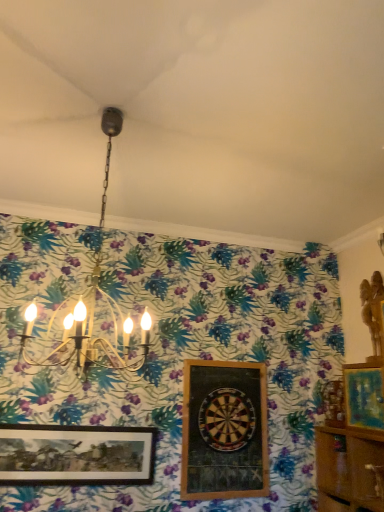
Question: Is gold metallic chandelier at upper center not close to wooden dartboard at center?

Choices:
 (A) yes
 (B) no

Answer: (B)

Question: Is gold metallic chandelier at upper center to the left of wooden dartboard at center from the viewer's perspective?

Choices:
 (A) yes
 (B) no

Answer: (A)

Question: Can you confirm if gold metallic chandelier at upper center is taller than wooden dartboard at center?

Choices:
 (A) yes
 (B) no

Answer: (A)

Question: Could wooden dartboard at center be considered to be inside gold metallic chandelier at upper center?

Choices:
 (A) yes
 (B) no

Answer: (B)

Question: From a real-world perspective, does gold metallic chandelier at upper center stand above wooden dartboard at center?

Choices:
 (A) no
 (B) yes

Answer: (B)

Question: Based on their positions, is wooden cabinet at lower right located to the left or right of teal matte painting at right, the first picture frame viewed from the right?

Choices:
 (A) left
 (B) right

Answer: (A)

Question: Is wooden cabinet at lower right in front of or behind teal matte painting at right, the 3th picture frame viewed from the left, in the image?

Choices:
 (A) front
 (B) behind

Answer: (A)

Question: In terms of width, does wooden cabinet at lower right look wider or thinner when compared to teal matte painting at right, the first picture frame viewed from the right?

Choices:
 (A) thin
 (B) wide

Answer: (B)

Question: Is wooden cabinet at lower right bigger or smaller than teal matte painting at right, the 3th picture frame viewed from the left?

Choices:
 (A) small
 (B) big

Answer: (B)

Question: Is point (354, 482) positioned closer to the camera than point (26, 356)?

Choices:
 (A) closer
 (B) farther

Answer: (A)

Question: Considering their positions, is wooden cabinet at lower right located in front of or behind gold metallic chandelier at upper center?

Choices:
 (A) front
 (B) behind

Answer: (B)

Question: Considering the positions of wooden cabinet at lower right and gold metallic chandelier at upper center in the image, is wooden cabinet at lower right bigger or smaller than gold metallic chandelier at upper center?

Choices:
 (A) big
 (B) small

Answer: (B)

Question: Is wooden cabinet at lower right taller or shorter than gold metallic chandelier at upper center?

Choices:
 (A) short
 (B) tall

Answer: (A)

Question: Does point (206, 429) appear closer or farther from the camera than point (210, 364)?

Choices:
 (A) closer
 (B) farther

Answer: (A)

Question: Considering the positions of wooden dartboard at center and wooden framed dartboard at center, which is counted as the 2th picture frame, starting from the left, in the image, is wooden dartboard at center wider or thinner than wooden framed dartboard at center, which is counted as the 2th picture frame, starting from the left,?

Choices:
 (A) thin
 (B) wide

Answer: (B)